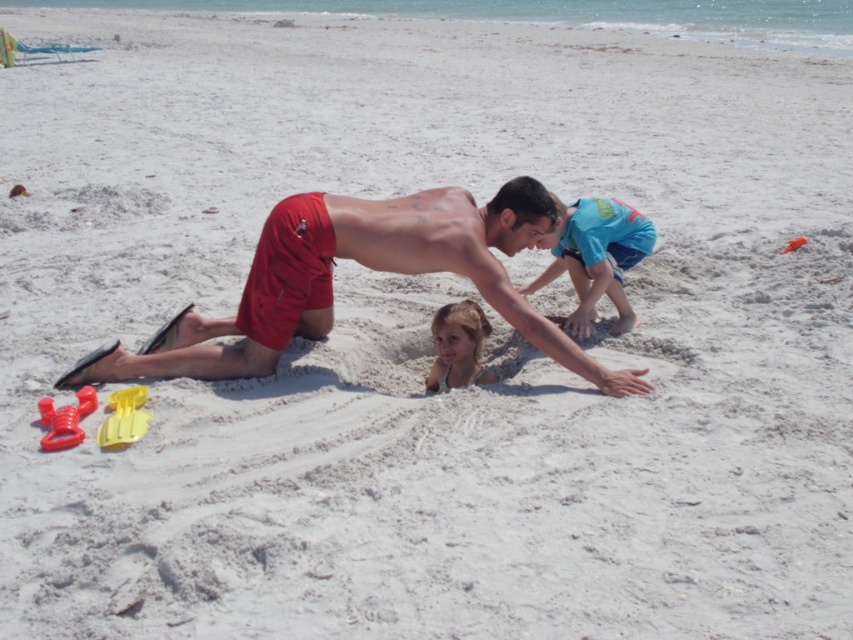
Is the position of red shorts at center more distant than that of blue cotton shirt at center?

No, it is not.

Who is positioned more to the right, red shorts at center or blue cotton shirt at center?

From the viewer's perspective, blue cotton shirt at center appears more on the right side.

Locate an element on the screen. This screenshot has width=853, height=640. red shorts at center is located at coordinates (363, 266).

Is point (637, 376) positioned after point (44, 413)?

That is True.

Does red shorts at center come behind rubber yellow shovel at lower left?

Yes.

Where is `red shorts at center`? red shorts at center is located at coordinates (363, 266).

Is rubber yellow shovel at lower left thinner than orange plastic shovel at center?

In fact, rubber yellow shovel at lower left might be wider than orange plastic shovel at center.

In order to click on rubber yellow shovel at lower left in this screenshot , I will do `click(65, 419)`.